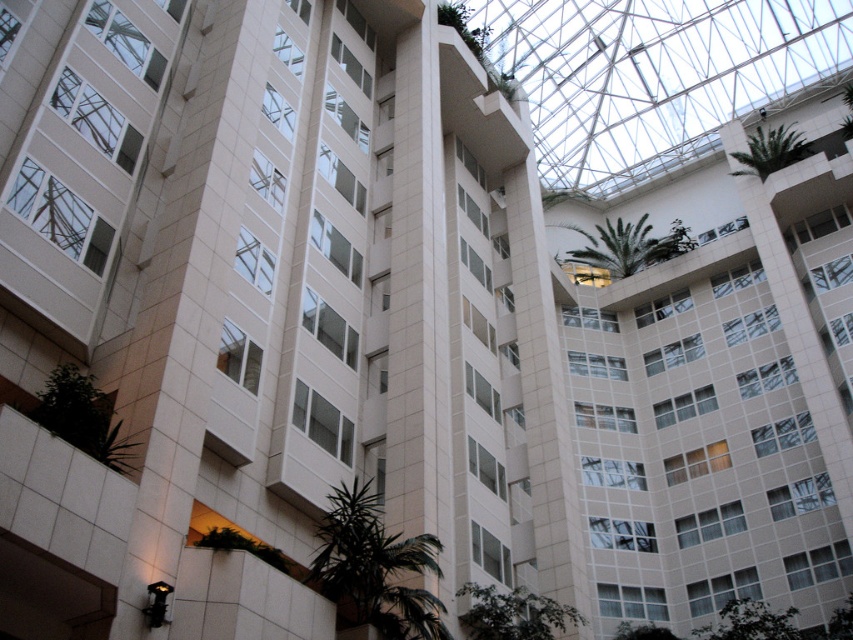
You are standing at the entrance of the modern building and want to locate a specific point marked as point (689, 246). Given that the point is 99.40 meters away from your current position, can you estimate how far you need to walk to reach it?

The point (689, 246) is 99.40 meters away from your current position, so you need to walk approximately 99.40 meters to reach it.

In the scene shown: You are standing at the entrance of the building and see the green leafy palm tree at lower center. There is an emergency exit sign located 132.66 feet away from the palm tree. If you walk straight towards the palm tree, will you reach the emergency exit sign before the palm tree?

The emergency exit sign is 132.66 feet away from the green leafy palm tree at lower center. Since you are walking towards the palm tree, the palm tree will be reached first before the emergency exit sign.